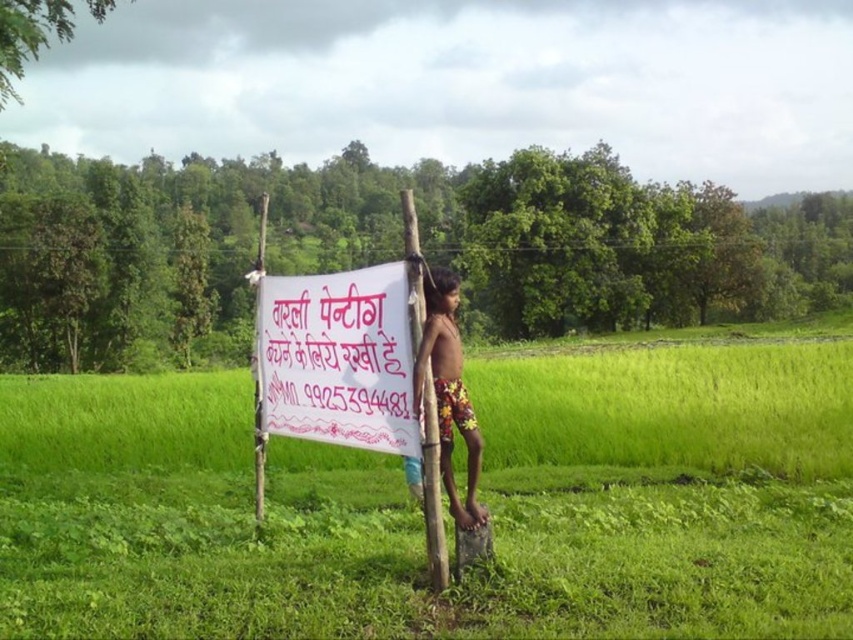
You are a tailor who needs to adjust the floral shorts at center to fit a customer. The customer mentions they want the shorts to be as long as the smooth bamboo pole at center. Is this possible given their current size?

The floral shorts at center has a smaller size compared to smooth bamboo pole at center, so it is not possible to adjust the floral shorts at center to match the length of the smooth bamboo pole at center.

You are a photographer trying to capture the boy in the scene. If you focus on the floral shorts at center, will the smooth bamboo pole at center also be in focus in the same photo?

The floral shorts at center is closer to the viewer than the smooth bamboo pole at center, so if you focus on the floral shorts at center, the smooth bamboo pole at center may not be in focus depending on the camera settings. However, since both are at the same central area, they might still appear in focus if the depth of field is sufficient.